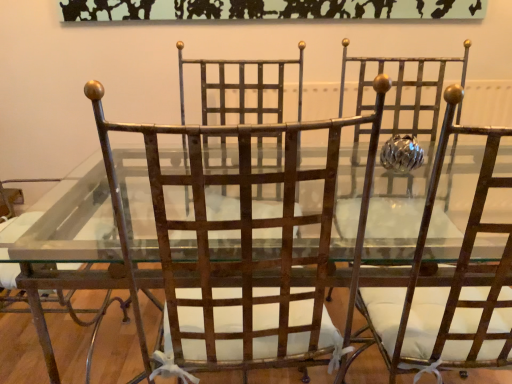
Question: Considering the relative sizes of rusty metal chair at center, which appears as the 3th chair when viewed from the left, and rusty metal chair at center, which is counted as the 2th chair, starting from the right, in the image provided, is rusty metal chair at center, which appears as the 3th chair when viewed from the left, thinner than rusty metal chair at center, which is counted as the 2th chair, starting from the right,?

Choices:
 (A) yes
 (B) no

Answer: (B)

Question: Is rusty metal chair at center, which appears as the 3th chair when viewed from the left, turned away from rusty metal chair at center, which is counted as the 2th chair, starting from the right?

Choices:
 (A) no
 (B) yes

Answer: (A)

Question: Is rusty metal chair at center, arranged as the 1th chair when viewed from the right, closer to the viewer compared to rusty metal chair at center, which is counted as the 2th chair, starting from the right?

Choices:
 (A) yes
 (B) no

Answer: (A)

Question: Considering the relative sizes of rusty metal chair at center, arranged as the 1th chair when viewed from the right, and rusty metal chair at center, which is counted as the 2th chair, starting from the right, in the image provided, is rusty metal chair at center, arranged as the 1th chair when viewed from the right, smaller than rusty metal chair at center, which is counted as the 2th chair, starting from the right,?

Choices:
 (A) no
 (B) yes

Answer: (A)

Question: Considering the relative sizes of rusty metal chair at center, which appears as the 3th chair when viewed from the left, and rusty metal chair at center, which is counted as the 2th chair, starting from the right, in the image provided, is rusty metal chair at center, which appears as the 3th chair when viewed from the left, taller than rusty metal chair at center, which is counted as the 2th chair, starting from the right,?

Choices:
 (A) no
 (B) yes

Answer: (A)

Question: Considering the positions of point (118, 124) and point (23, 286), is point (118, 124) closer or farther from the camera than point (23, 286)?

Choices:
 (A) closer
 (B) farther

Answer: (B)

Question: Considering the positions of rusty metal chair at center, acting as the 2th chair starting from the left, and rusty metal chair at left, marked as the 3th chair in a right-to-left arrangement, in the image, is rusty metal chair at center, acting as the 2th chair starting from the left, wider or thinner than rusty metal chair at left, marked as the 3th chair in a right-to-left arrangement,?

Choices:
 (A) thin
 (B) wide

Answer: (A)

Question: In terms of size, does rusty metal chair at center, acting as the 2th chair starting from the left, appear bigger or smaller than rusty metal chair at left, arranged as the 1th chair when viewed from the left?

Choices:
 (A) big
 (B) small

Answer: (B)

Question: From their relative heights in the image, would you say rusty metal chair at center, which is counted as the 2th chair, starting from the right, is taller or shorter than rusty metal chair at left, marked as the 3th chair in a right-to-left arrangement?

Choices:
 (A) tall
 (B) short

Answer: (A)

Question: From the image's perspective, relative to rusty metal chair at center, which is counted as the 2th chair, starting from the right, is rusty metal chair at center, which appears as the 3th chair when viewed from the left, above or below?

Choices:
 (A) above
 (B) below

Answer: (A)

Question: Looking at the image, does rusty metal chair at center, which appears as the 3th chair when viewed from the left, seem bigger or smaller compared to rusty metal chair at center, acting as the 2th chair starting from the left?

Choices:
 (A) big
 (B) small

Answer: (A)

Question: From a real-world perspective, is rusty metal chair at center, which appears as the 3th chair when viewed from the left, above or below rusty metal chair at center, acting as the 2th chair starting from the left?

Choices:
 (A) below
 (B) above

Answer: (B)

Question: Would you say rusty metal chair at center, arranged as the 1th chair when viewed from the right, is to the left or to the right of rusty metal chair at center, which is counted as the 2th chair, starting from the right, in the picture?

Choices:
 (A) left
 (B) right

Answer: (B)

Question: From the image's perspective, relative to rusty metal chair at center, arranged as the 1th chair when viewed from the right, is rusty metal chair at center, acting as the 2th chair starting from the left, above or below?

Choices:
 (A) below
 (B) above

Answer: (A)

Question: In the image, is rusty metal chair at center, acting as the 2th chair starting from the left, positioned in front of or behind rusty metal chair at center, arranged as the 1th chair when viewed from the right?

Choices:
 (A) front
 (B) behind

Answer: (B)